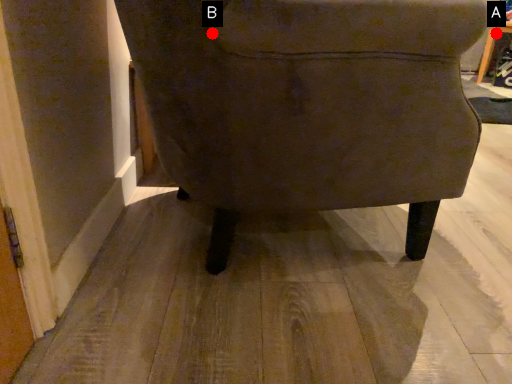
Question: Two points are circled on the image, labeled by A and B beside each circle. Which point appears closest to the camera in this image?

Choices:
 (A) A is closer
 (B) B is closer

Answer: (B)